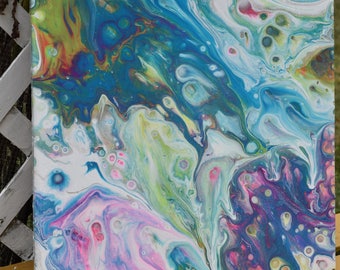
The width and height of the screenshot is (340, 270). I want to click on white paint, so click(39, 110).